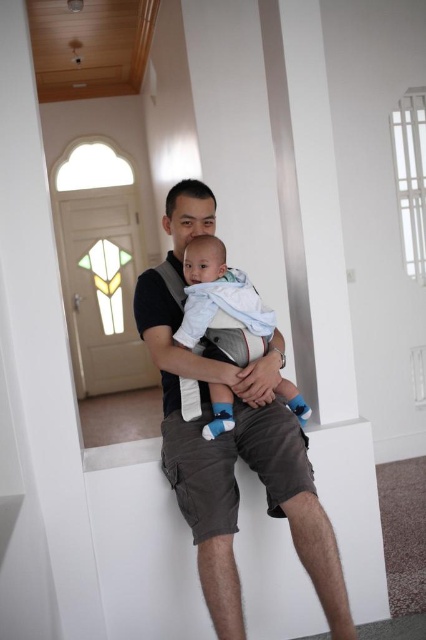
Does dark gray cotton shirt at center have a greater height compared to light blue fabric baby at center?

Indeed, dark gray cotton shirt at center has a greater height compared to light blue fabric baby at center.

Can you confirm if dark gray cotton shirt at center is shorter than light blue fabric baby at center?

In fact, dark gray cotton shirt at center may be taller than light blue fabric baby at center.

Is point (339, 600) farther from viewer compared to point (224, 403)?

No, it is in front of (224, 403).

Identify the location of dark gray cotton shirt at center. (233, 465).